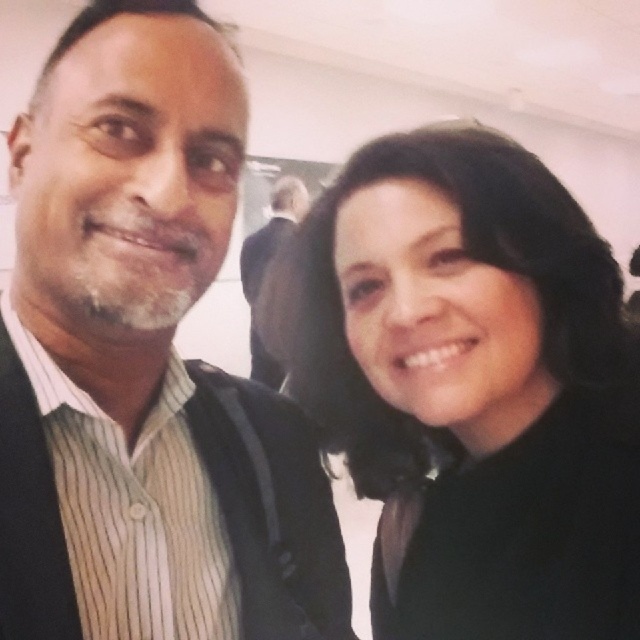
Question: Which object appears closest to the camera in this image?

Choices:
 (A) dark suit at center
 (B) striped cotton shirt at left

Answer: (B)

Question: Does black matte hair at center appear over dark suit at center?

Choices:
 (A) yes
 (B) no

Answer: (B)

Question: Can you confirm if striped cotton shirt at left is wider than black matte hair at center?

Choices:
 (A) no
 (B) yes

Answer: (A)

Question: Which object is closer to the camera taking this photo?

Choices:
 (A) striped cotton shirt at left
 (B) black matte hair at center

Answer: (A)

Question: Is striped cotton shirt at left thinner than dark suit at center?

Choices:
 (A) no
 (B) yes

Answer: (B)

Question: Which is nearer to the dark suit at center?

Choices:
 (A) black matte hair at center
 (B) striped cotton shirt at left

Answer: (A)